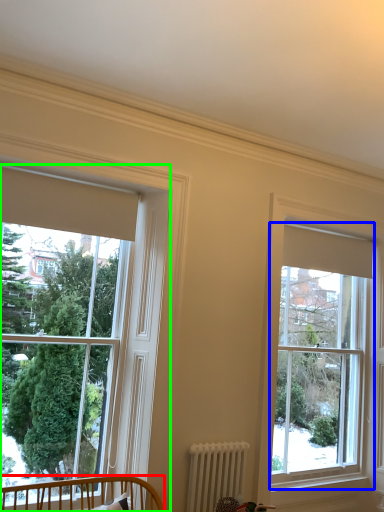
Question: Which object is the farthest from furniture (highlighted by a red box)? Choose among these: window (highlighted by a blue box) or window (highlighted by a green box).

Choices:
 (A) window
 (B) window

Answer: (A)